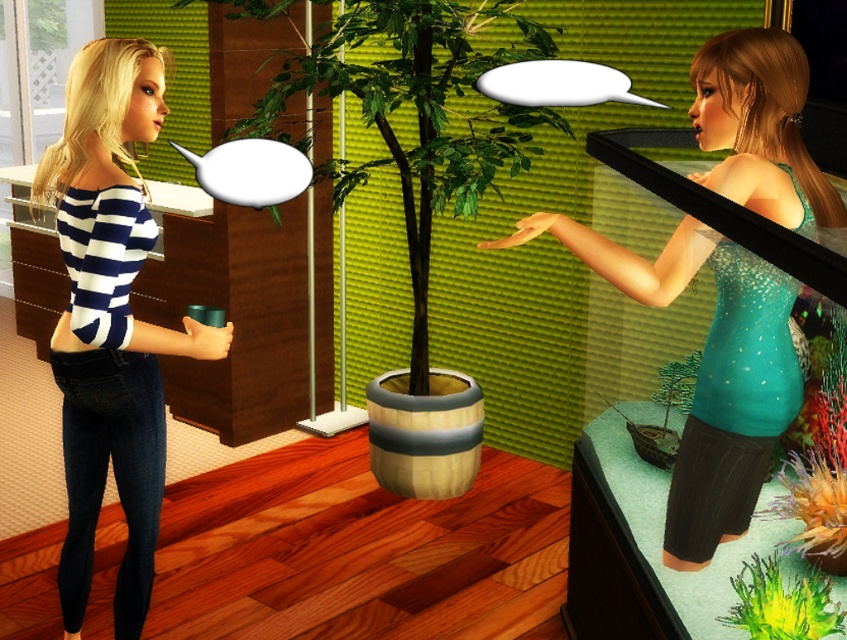
Is teal glitter tank top at center taller than green matte plant at center?

Correct, teal glitter tank top at center is much taller as green matte plant at center.

Is point (783, 353) more distant than point (662, 387)?

No, (783, 353) is in front of (662, 387).

Who is more forward, (x=767, y=417) or (x=668, y=397)?

Point (x=767, y=417)

This screenshot has width=847, height=640. What are the coordinates of `teal glitter tank top at center` in the screenshot? It's located at (732, 413).

Looking at this image, can you confirm if teal glitter tank top at center is thinner than denim jeans at left?

No, teal glitter tank top at center is not thinner than denim jeans at left.

Measure the distance between teal glitter tank top at center and denim jeans at left.

The distance of teal glitter tank top at center from denim jeans at left is 6.14 feet.

Does point (765, 330) come farther from viewer compared to point (125, 300)?

No.

Identify the location of teal glitter tank top at center. (732, 413).

Who is more distant from viewer, (718,493) or (774,637)?

The point (718,493) is behind.

Does teal glitter tank top at center appear on the left side of green matte plant at lower right?

Yes, teal glitter tank top at center is to the left of green matte plant at lower right.

Is point (738, 52) behind point (822, 596)?

Yes, point (738, 52) is behind point (822, 596).

Find the location of `teal glitter tank top at center`. teal glitter tank top at center is located at coordinates (732, 413).